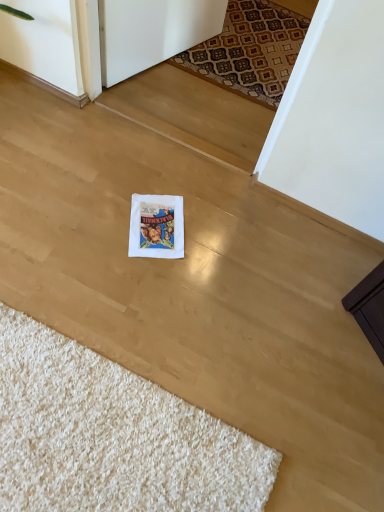
The image size is (384, 512). I want to click on free spot below white shaggy rug at lower left (from a real-world perspective), so click(92, 435).